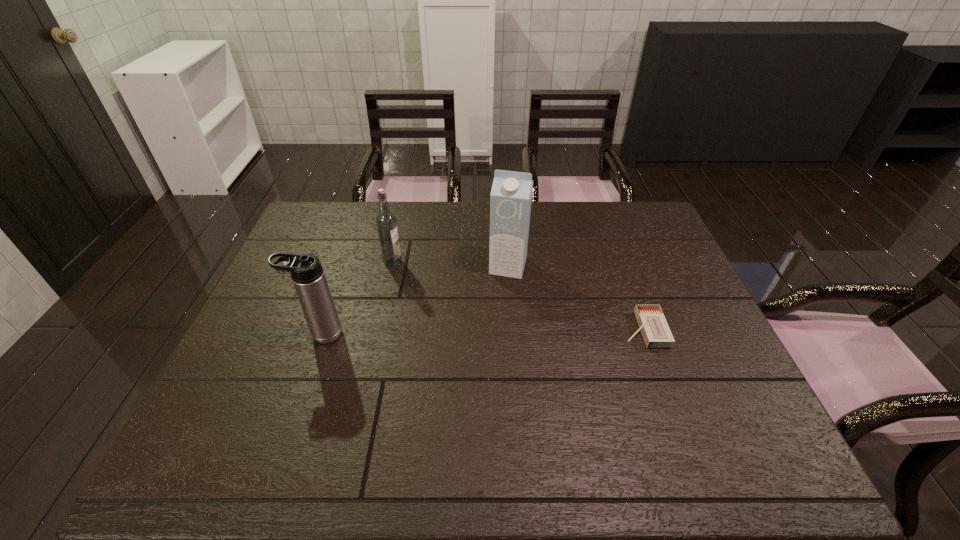
Where is `the leftmost object`? The image size is (960, 540). the leftmost object is located at coordinates click(307, 274).

In order to click on the shortest object in this screenshot , I will do pos(654,328).

Identify the location of the rightmost object. (654, 328).

I want to click on the tallest object, so click(510, 200).

I want to click on the second object from right to left, so click(510, 200).

Where is `vodka`? vodka is located at coordinates (386, 221).

Find the location of `blank space located on the handle side of the thermos bottle`. blank space located on the handle side of the thermos bottle is located at coordinates (272, 334).

Locate an element on the screen. The height and width of the screenshot is (540, 960). vacant area located on the handle side of the thermos bottle is located at coordinates (276, 334).

At what (x,y) coordinates should I click in order to perform the action: click on vacant space located 0.110m on the handle side of the thermos bottle. Please return your answer as a coordinate pair (x, y). The width and height of the screenshot is (960, 540). Looking at the image, I should click on (256, 334).

Where is `free spot located 0.170m on the striking surface of the shortest object`? The height and width of the screenshot is (540, 960). free spot located 0.170m on the striking surface of the shortest object is located at coordinates (559, 329).